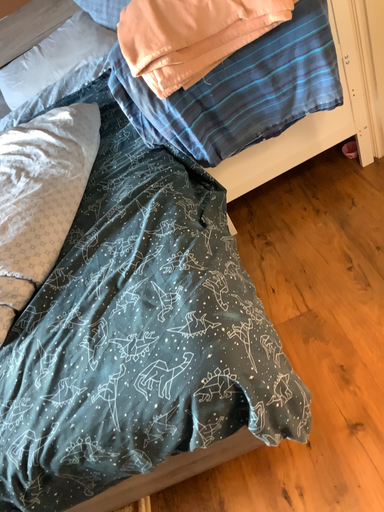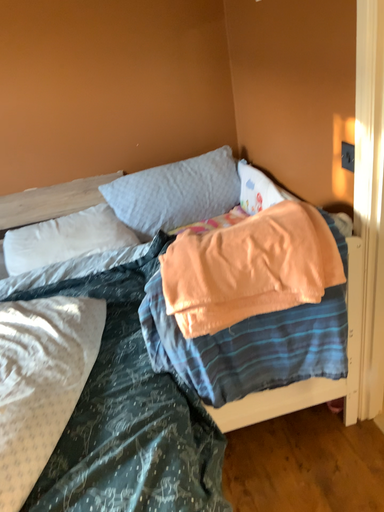
Question: How did the camera likely rotate when shooting the video?

Choices:
 (A) rotated upward
 (B) rotated downward

Answer: (A)